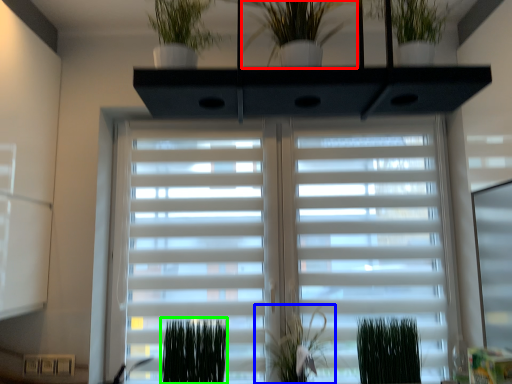
Question: Which object is the closest to the houseplant (highlighted by a red box)? Choose among these: plant (highlighted by a blue box) or plant (highlighted by a green box).

Choices:
 (A) plant
 (B) plant

Answer: (A)